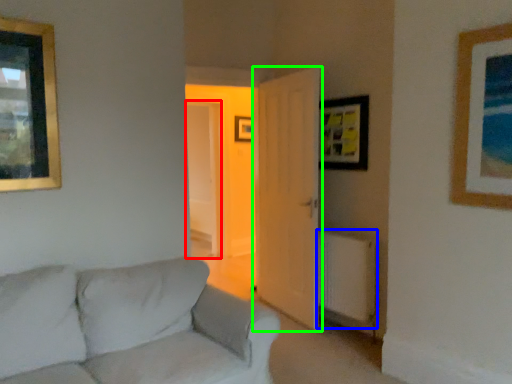
Question: Estimate the real-world distances between objects in this image. Which object is farther from glass door (highlighted by a red box), radiator (highlighted by a blue box) or door (highlighted by a green box)?

Choices:
 (A) radiator
 (B) door

Answer: (A)